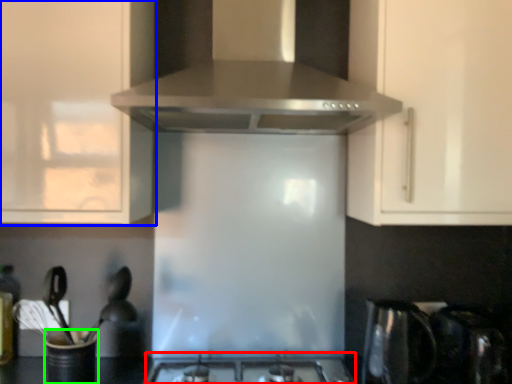
Question: Estimate the real-world distances between objects in this image. Which object is farther from gas stove (highlighted by a red box), cabinetry (highlighted by a blue box) or appliance (highlighted by a green box)?

Choices:
 (A) cabinetry
 (B) appliance

Answer: (A)